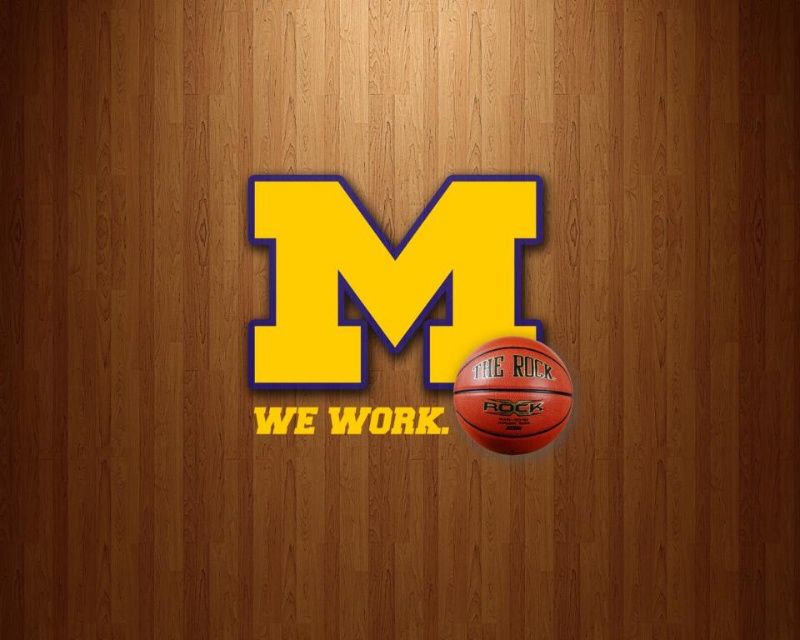
Question: Can you confirm if rubber textured basketball at center is positioned to the left of rubber textured basketball at lower right?

Choices:
 (A) yes
 (B) no

Answer: (A)

Question: Is rubber textured basketball at center bigger than rubber textured basketball at lower right?

Choices:
 (A) yes
 (B) no

Answer: (A)

Question: Does rubber textured basketball at center have a lesser width compared to rubber textured basketball at lower right?

Choices:
 (A) yes
 (B) no

Answer: (B)